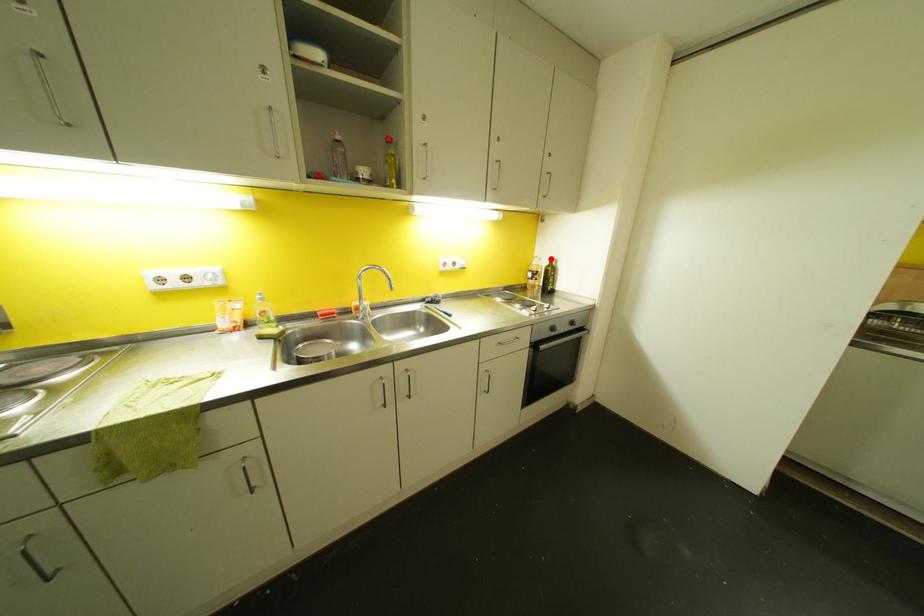
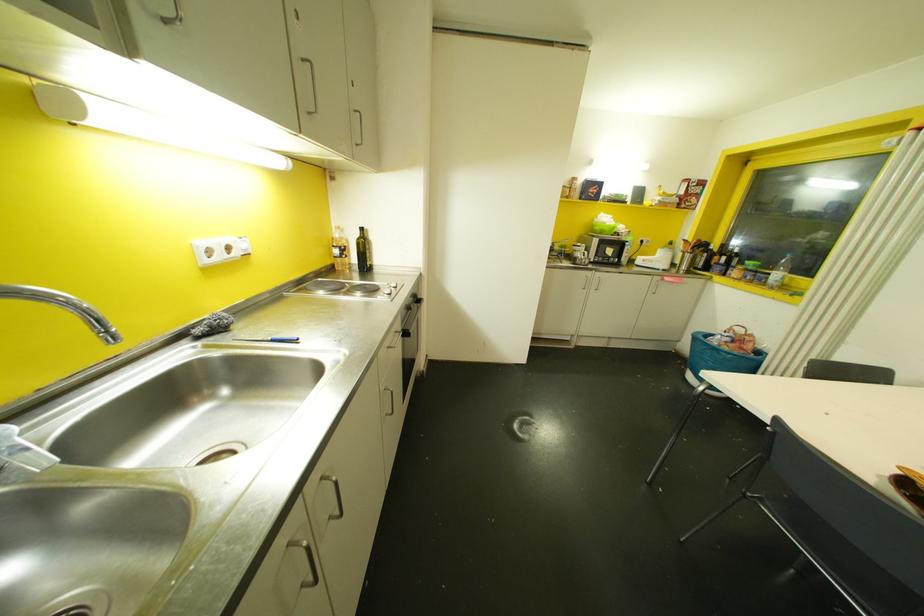
In the second image, find the point that corresponds to the highlighted location in the first image.

(360, 229)